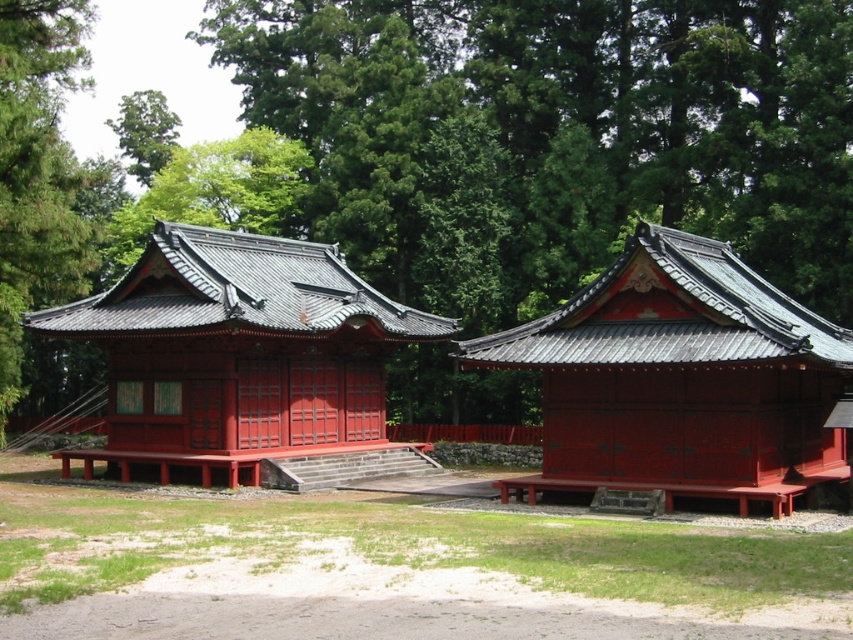
Question: Which of the following is the farthest from the observer?

Choices:
 (A) (270, 307)
 (B) (235, 225)
 (C) (566, 314)

Answer: (B)

Question: Which of the following is the farthest from the observer?

Choices:
 (A) shiny lacquered shrine at center
 (B) shiny red wood gazebo at center
 (C) green leafy tree at upper center

Answer: (A)

Question: Does green leafy tree at upper center appear under shiny red wood gazebo at center?

Choices:
 (A) yes
 (B) no

Answer: (B)

Question: Can you confirm if green leafy tree at upper center is positioned above shiny lacquered shrine at center?

Choices:
 (A) yes
 (B) no

Answer: (A)

Question: Which object is farther from the camera taking this photo?

Choices:
 (A) green leafy tree at upper center
 (B) shiny lacquered shrine at center
 (C) shiny red wood gazebo at center

Answer: (B)

Question: Is green leafy tree at upper center wider than shiny lacquered shrine at center?

Choices:
 (A) yes
 (B) no

Answer: (A)